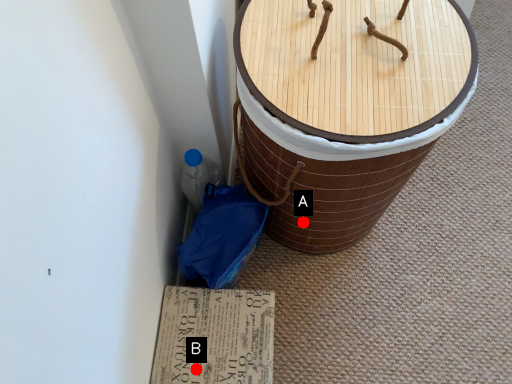
Question: Two points are circled on the image, labeled by A and B beside each circle. Which point appears farthest from the camera in this image?

Choices:
 (A) A is further
 (B) B is further

Answer: (A)